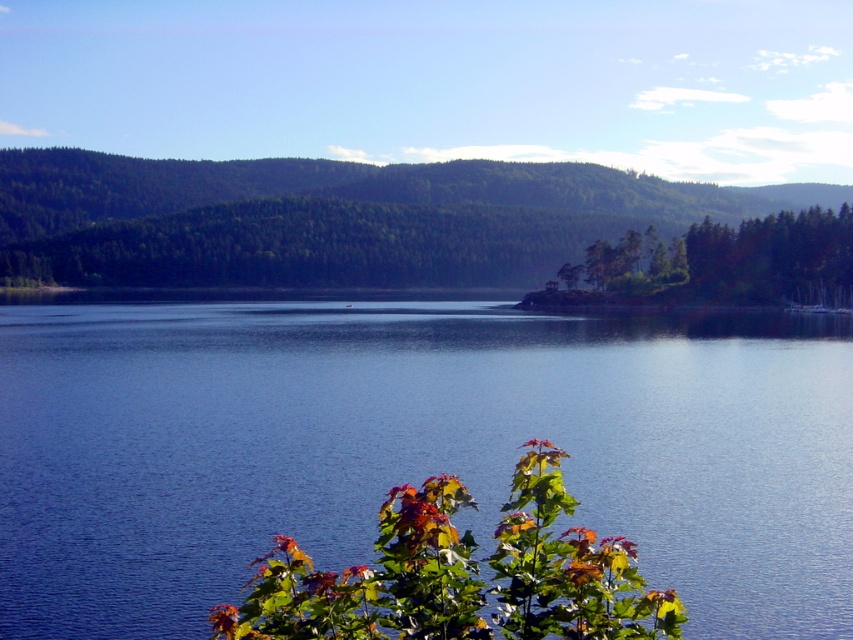
Is point (144, 381) closer to camera compared to point (231, 240)?

That is True.

Which is behind, point (48, 513) or point (306, 212)?

The point (306, 212) is more distant.

Image resolution: width=853 pixels, height=640 pixels. What do you see at coordinates (410, 448) in the screenshot?
I see `blue water at center` at bounding box center [410, 448].

Locate an element on the screen. blue water at center is located at coordinates (410, 448).

In the scene shown: Which of these two, green forested mountain at upper left or multicolored leafy tree at lower center, stands taller?

green forested mountain at upper left

Does green forested mountain at upper left come behind multicolored leafy tree at lower center?

Yes, it is behind multicolored leafy tree at lower center.

Does point (260, 275) come farther from viewer compared to point (566, 561)?

Yes, it is.

Where is `green forested mountain at upper left`? This screenshot has width=853, height=640. green forested mountain at upper left is located at coordinates coord(325,218).

Who is positioned more to the left, green forested mountain at upper left or green matte tree at center-right?

green forested mountain at upper left is more to the left.

Which of these two, green forested mountain at upper left or green matte tree at center-right, stands shorter?

green matte tree at center-right

Is point (22, 205) farther from camera compared to point (788, 253)?

Yes, it is behind point (788, 253).

Where is `green forested mountain at upper left`? The height and width of the screenshot is (640, 853). green forested mountain at upper left is located at coordinates (325, 218).